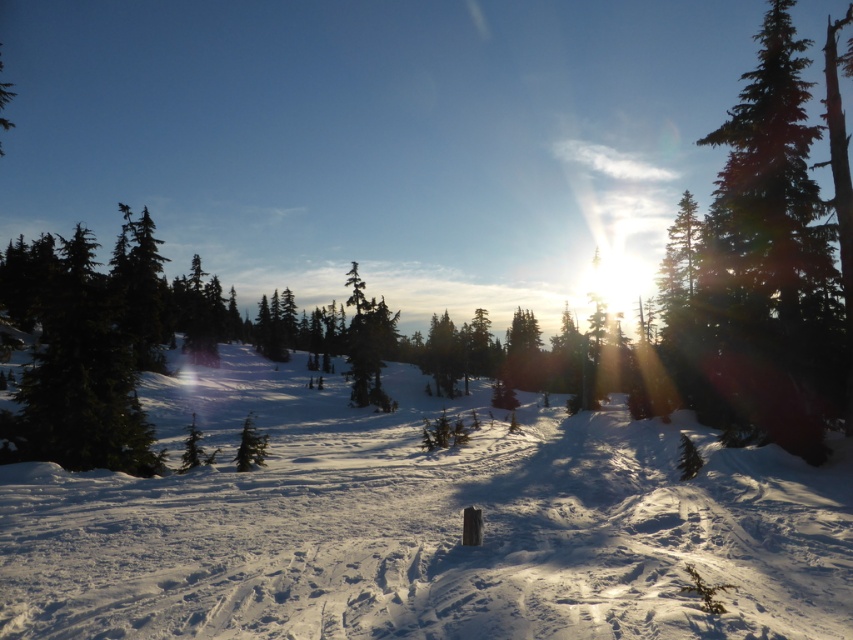
What are the coordinates of the white powdery snow at center?

The white powdery snow at center is located at coordinates point (422, 524).

You are a hiker planning to cross the white powdery snow at center and reach the green textured pine tree at right. Given that your snowshoes can support walking on snow up to 50 feet away, will you be able to make the journey without needing to rest?

The distance between the white powdery snow at center and the green textured pine tree at right is 56.51 feet, which exceeds the snowshoes maximum support range of 50 feet. Therefore, you will need to rest or take breaks during the journey.